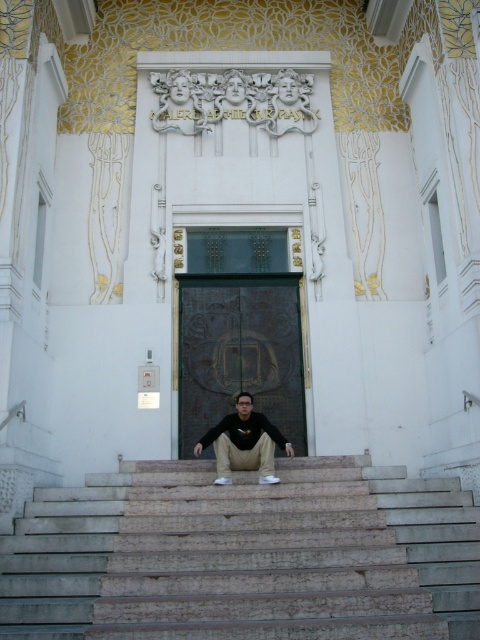
Which is below, marble stairs at center or black matte shirt at center?

Positioned lower is marble stairs at center.

The image size is (480, 640). Describe the element at coordinates (243, 556) in the screenshot. I see `marble stairs at center` at that location.

Identify the location of marble stairs at center. The height and width of the screenshot is (640, 480). (243, 556).